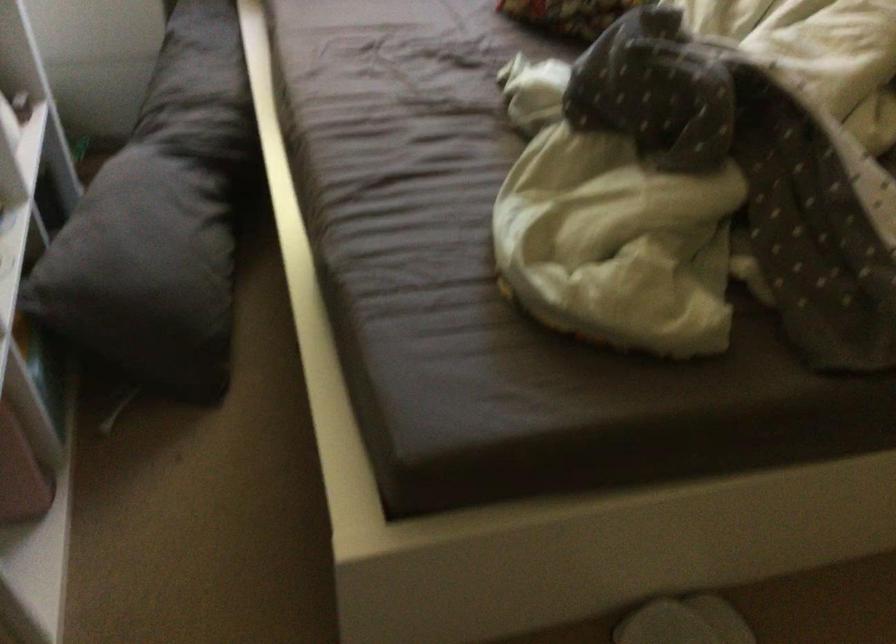
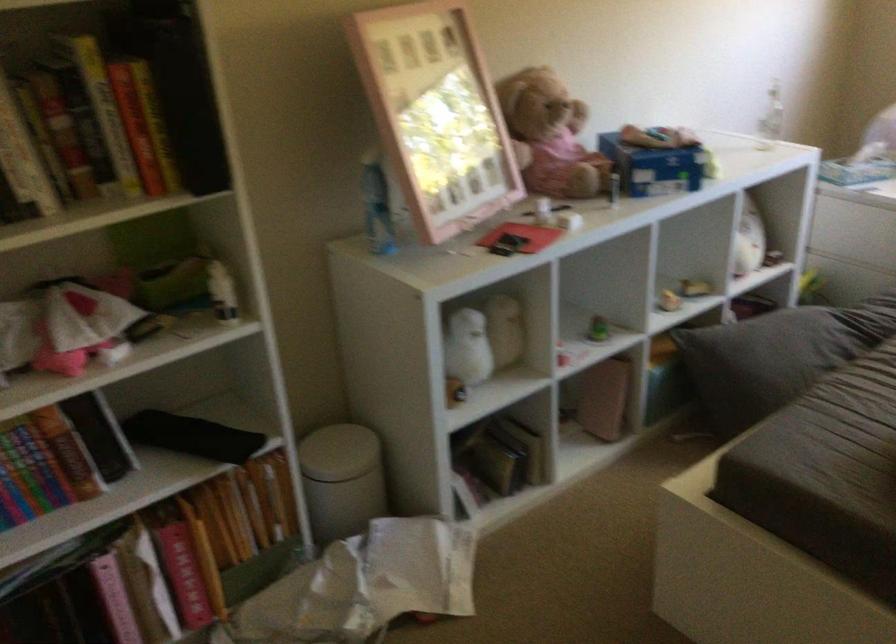
Locate, in the second image, the point that corresponds to (161,275) in the first image.

(776, 357)